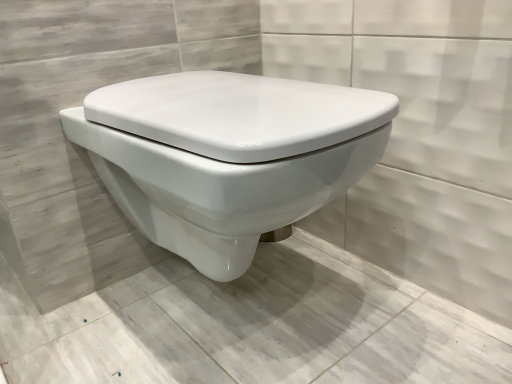
The width and height of the screenshot is (512, 384). What do you see at coordinates (254, 327) in the screenshot?
I see `white glossy toilet at center` at bounding box center [254, 327].

Locate an element on the screen. This screenshot has height=384, width=512. white glossy toilet at center is located at coordinates (254, 327).

Locate an element on the screen. white glossy toilet at center is located at coordinates (227, 156).

This screenshot has height=384, width=512. Describe the element at coordinates (227, 156) in the screenshot. I see `white glossy toilet at center` at that location.

Measure the distance between point (151, 101) and camera.

They are 63.50 centimeters apart.

What is the approximate height of white glossy toilet at center?

white glossy toilet at center is 17.89 inches tall.

Where is `white glossy toilet at center`? The image size is (512, 384). white glossy toilet at center is located at coordinates (254, 327).

Consider the image. Between white glossy toilet at center and white glossy toilet at center, which one appears on the left side from the viewer's perspective?

white glossy toilet at center.

Is white glossy toilet at center positioned behind white glossy toilet at center?

No, white glossy toilet at center is in front of white glossy toilet at center.

Is point (125, 352) closer or farther from the camera than point (372, 120)?

Point (125, 352) appears to be farther away from the viewer than point (372, 120).

From the image's perspective, which is above, white glossy toilet at center or white glossy toilet at center?

From the image's view, white glossy toilet at center is above.

From a real-world perspective, is white glossy toilet at center physically below white glossy toilet at center?

Correct, in the physical world, white glossy toilet at center is lower than white glossy toilet at center.

Between white glossy toilet at center and white glossy toilet at center, which one has larger width?

white glossy toilet at center.

From the picture: Considering the sizes of objects white glossy toilet at center and white glossy toilet at center in the image provided, who is taller, white glossy toilet at center or white glossy toilet at center?

white glossy toilet at center.

Can you confirm if white glossy toilet at center is bigger than white glossy toilet at center?

Actually, white glossy toilet at center might be smaller than white glossy toilet at center.

Would you say white glossy toilet at center is part of white glossy toilet at center's contents?

Definitely not — white glossy toilet at center is not inside white glossy toilet at center.

Is white glossy toilet at center in contact with white glossy toilet at center?

No, white glossy toilet at center is not touching white glossy toilet at center.

Is white glossy toilet at center oriented towards white glossy toilet at center?

No, white glossy toilet at center is not facing towards white glossy toilet at center.

What's the angular difference between white glossy toilet at center and white glossy toilet at center's facing directions?

89.5 degrees separate the facing orientations of white glossy toilet at center and white glossy toilet at center.

Locate an element on the screen. Image resolution: width=512 pixels, height=384 pixels. concrete in front of the white glossy toilet at center is located at coordinates click(254, 327).

Considering the positions of objects white glossy toilet at center and white glossy toilet at center in the image provided, who is more to the left, white glossy toilet at center or white glossy toilet at center?

white glossy toilet at center.

Is white glossy toilet at center positioned in front of white glossy toilet at center?

No, it is not.

Which point is more forward, [362,97] or [411,362]?

The point [362,97] is closer to the camera.

From the image's perspective, is white glossy toilet at center located beneath white glossy toilet at center?

Actually, white glossy toilet at center appears above white glossy toilet at center in the image.

From a real-world perspective, which is physically below, white glossy toilet at center or white glossy toilet at center?

white glossy toilet at center is physically lower.

Can you confirm if white glossy toilet at center is thinner than white glossy toilet at center?

Yes.

Who is taller, white glossy toilet at center or white glossy toilet at center?

white glossy toilet at center is taller.

Between white glossy toilet at center and white glossy toilet at center, which one has smaller size?

Smaller between the two is white glossy toilet at center.

Is white glossy toilet at center surrounding white glossy toilet at center?

No, white glossy toilet at center is not a part of white glossy toilet at center.

Is the surface of white glossy toilet at center in direct contact with white glossy toilet at center?

No, white glossy toilet at center is not making contact with white glossy toilet at center.

Could you tell me if white glossy toilet at center is facing white glossy toilet at center?

No, white glossy toilet at center is not turned towards white glossy toilet at center.

Measure the distance between white glossy toilet at center and white glossy toilet at center.

12.32 inches.

There is a white glossy toilet at center. What are the coordinates of `toilet above it (from a real-world perspective)` in the screenshot? It's located at (227, 156).

At what (x,y) coordinates should I click in order to perform the action: click on toilet above the white glossy toilet at center (from the image's perspective). Please return your answer as a coordinate pair (x, y). Image resolution: width=512 pixels, height=384 pixels. Looking at the image, I should click on (227, 156).

Locate an element on the screen. toilet to the right of white glossy toilet at center is located at coordinates (227, 156).